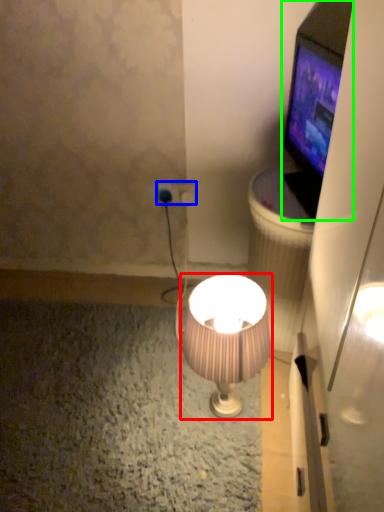
Question: Which is nearer to the lamp (highlighted by a red box)? power plugs and sockets (highlighted by a blue box) or television (highlighted by a green box).

Choices:
 (A) power plugs and sockets
 (B) television

Answer: (B)